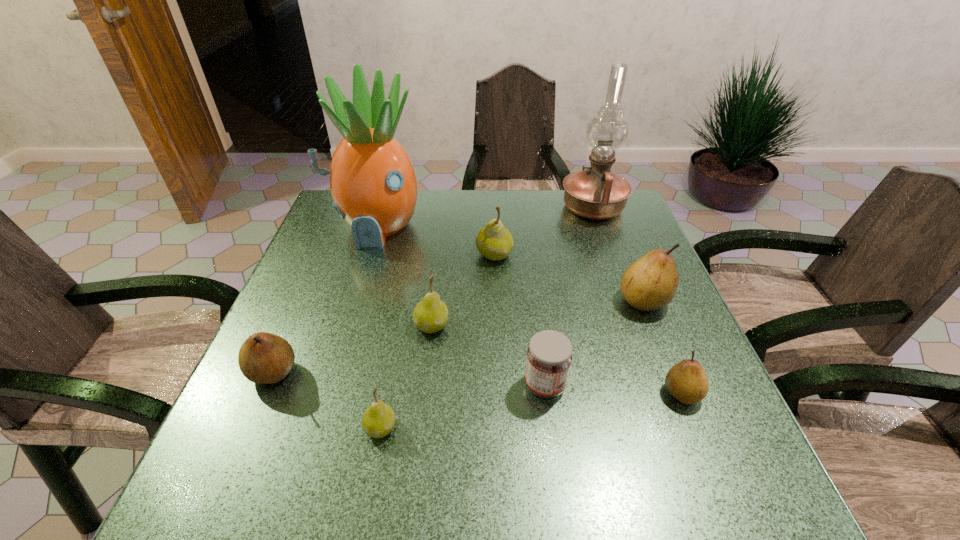
Where is `free spot between the second green pear from left to right and the oil lamp`? This screenshot has width=960, height=540. free spot between the second green pear from left to right and the oil lamp is located at coordinates (513, 267).

Image resolution: width=960 pixels, height=540 pixels. I want to click on vacant area between the oil lamp and the orange pineapple, so click(x=484, y=217).

Where is `empty space that is in between the pineapple and the second green pear from right to left`? This screenshot has height=540, width=960. empty space that is in between the pineapple and the second green pear from right to left is located at coordinates (403, 276).

Find the location of a particular element. empty space between the red jam and the leftmost pear is located at coordinates (409, 379).

The image size is (960, 540). In order to click on object that is the third closest to the oil lamp in this screenshot , I will do `click(372, 180)`.

Where is `object that is the second closest to the smallest brown pear`? This screenshot has width=960, height=540. object that is the second closest to the smallest brown pear is located at coordinates (549, 356).

Locate which pear ranks in proximity to the farthest brown pear. Please provide its 2D coordinates. Your answer should be formatted as a tuple, i.e. [(x, y)], where the tuple contains the x and y coordinates of a point satisfying the conditions above.

[(686, 381)]

Identify which pear is the fifth nearest to the second biggest brown pear. Please provide its 2D coordinates. Your answer should be formatted as a tuple, i.e. [(x, y)], where the tuple contains the x and y coordinates of a point satisfying the conditions above.

[(686, 381)]

Locate which brown pear ranks third in proximity to the rightmost green pear. Please provide its 2D coordinates. Your answer should be formatted as a tuple, i.e. [(x, y)], where the tuple contains the x and y coordinates of a point satisfying the conditions above.

[(264, 358)]

At what (x,y) coordinates should I click in order to perform the action: click on brown pear that stands as the second closest to the red jam. Please return your answer as a coordinate pair (x, y). Image resolution: width=960 pixels, height=540 pixels. Looking at the image, I should click on (650, 283).